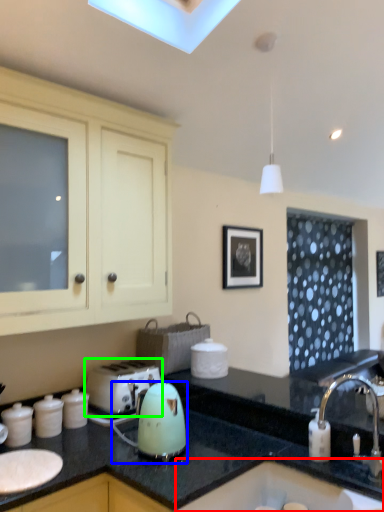
Question: Estimate the real-world distances between objects in this image. Which object is closer to sink (highlighted by a red box), kitchen appliance (highlighted by a blue box) or toaster (highlighted by a green box)?

Choices:
 (A) kitchen appliance
 (B) toaster

Answer: (A)